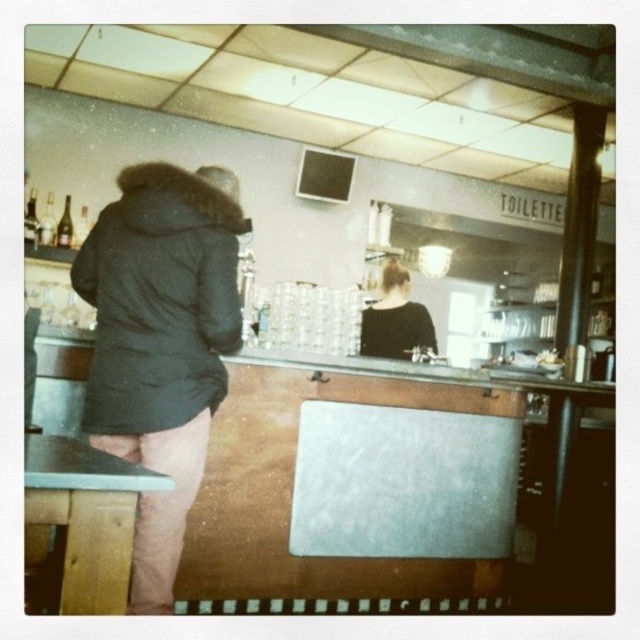
Question: Which of the following is the closest to the observer?

Choices:
 (A) (67, 515)
 (B) (220, 193)
 (C) (392, 317)
 (D) (189, 113)

Answer: (A)

Question: Is metallic silver exhaust hood at upper center positioned behind dark gray fur-lined coat at center?

Choices:
 (A) yes
 (B) no

Answer: (A)

Question: Among these points, which one is farthest from the camera?

Choices:
 (A) (51, 51)
 (B) (28, 500)
 (C) (419, 310)
 (D) (109, 422)

Answer: (A)

Question: Can you confirm if dark gray fur-lined coat at center is smaller than wooden bar stool at lower left?

Choices:
 (A) yes
 (B) no

Answer: (B)

Question: Does metallic silver exhaust hood at upper center appear over dark gray fur-lined coat at center?

Choices:
 (A) yes
 (B) no

Answer: (A)

Question: Based on their relative distances, which object is farther from the dark gray fur-lined coat at center?

Choices:
 (A) wooden bar stool at lower left
 (B) metallic silver exhaust hood at upper center
 (C) black matte shirt at center

Answer: (B)